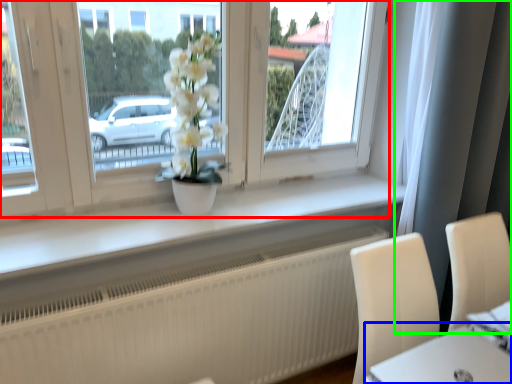
Question: Which object is the closest to the window (highlighted by a red box)? Choose among these: round table (highlighted by a blue box) or curtain (highlighted by a green box).

Choices:
 (A) round table
 (B) curtain

Answer: (B)